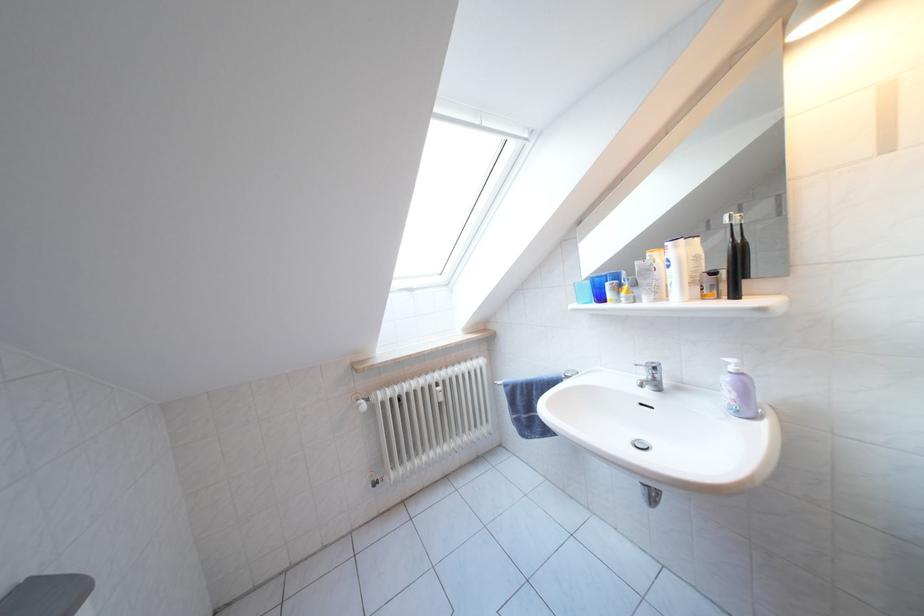
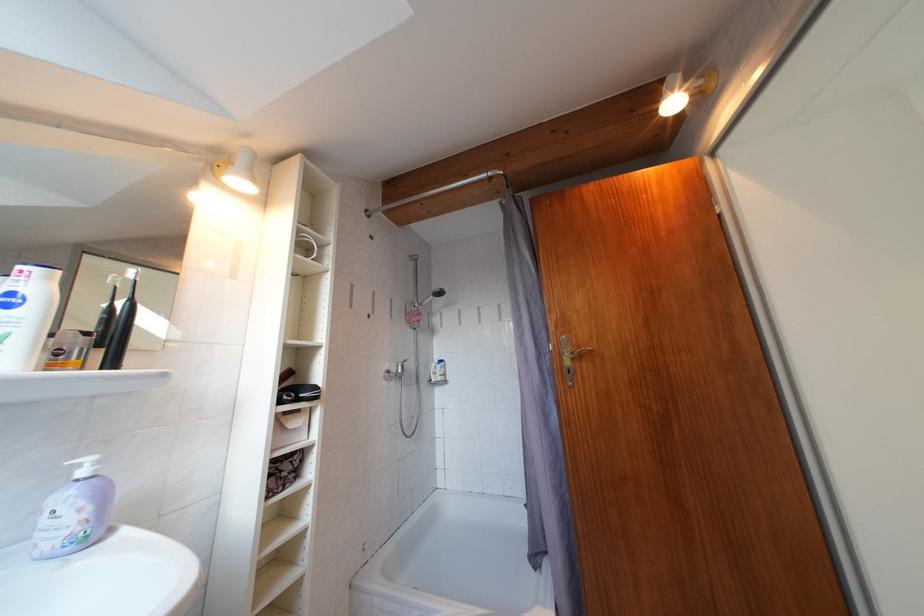
The point at (739, 374) is marked in the first image. Where is the corresponding point in the second image?

(92, 477)